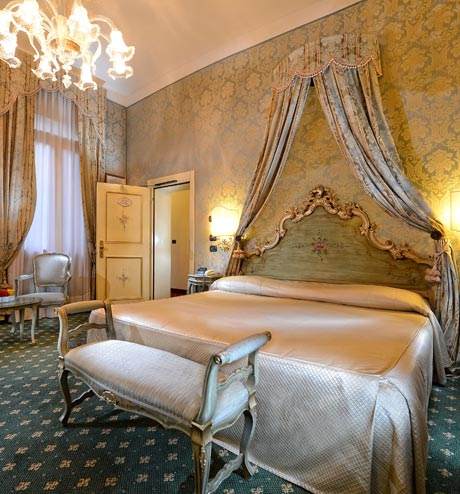
This screenshot has width=460, height=494. In order to click on 2 colors on carpet in this screenshot , I will do `click(66, 464)`, `click(66, 474)`.